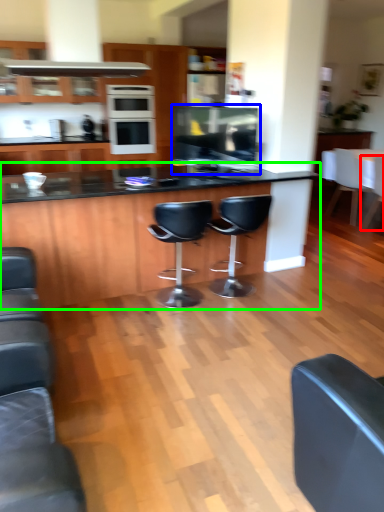
Question: Which object is positioned closest to chair (highlighted by a red box)? Select from appliance (highlighted by a blue box) and table (highlighted by a green box).

Choices:
 (A) appliance
 (B) table

Answer: (A)